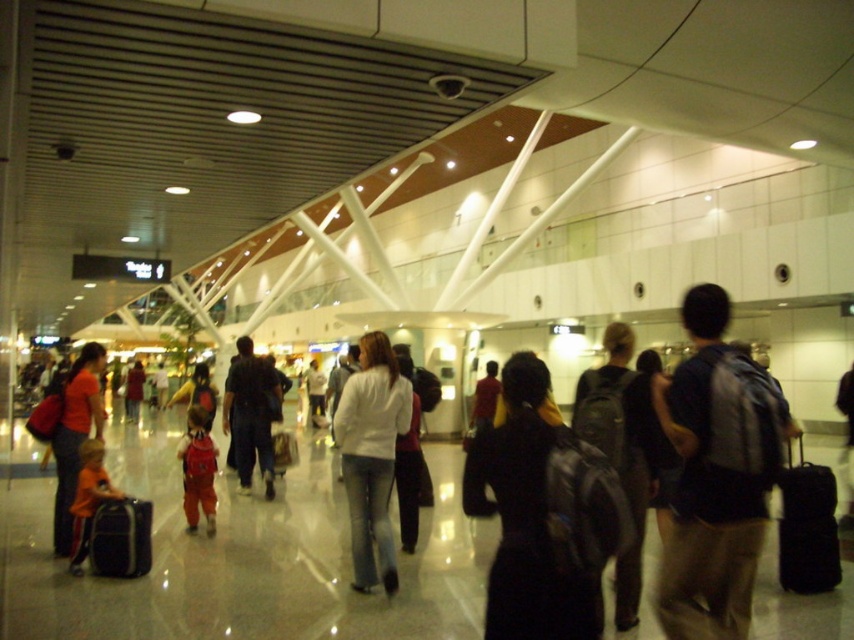
Question: Based on their relative distances, which object is farther from the white matte jacket at center?

Choices:
 (A) orange fabric child at center
 (B) black matte backpack at center

Answer: (B)

Question: Which object appears farthest from the camera in this image?

Choices:
 (A) black fabric suitcase at lower left
 (B) dark blue jeans at center
 (C) dark gray backpack at center right

Answer: (B)

Question: Which object is positioned farthest from the matte black backpack at center?

Choices:
 (A) matte red jacket at center
 (B) orange fabric child at center
 (C) dark blue jeans at center

Answer: (A)

Question: Is dark blue jeans at center to the right of orange fabric child at center from the viewer's perspective?

Choices:
 (A) yes
 (B) no

Answer: (A)

Question: Can you confirm if dark gray backpack at center right is positioned to the left of red fabric child at center?

Choices:
 (A) yes
 (B) no

Answer: (B)

Question: From the image, what is the correct spatial relationship of white matte jacket at center in relation to black fabric suitcase at lower left?

Choices:
 (A) left
 (B) right

Answer: (B)